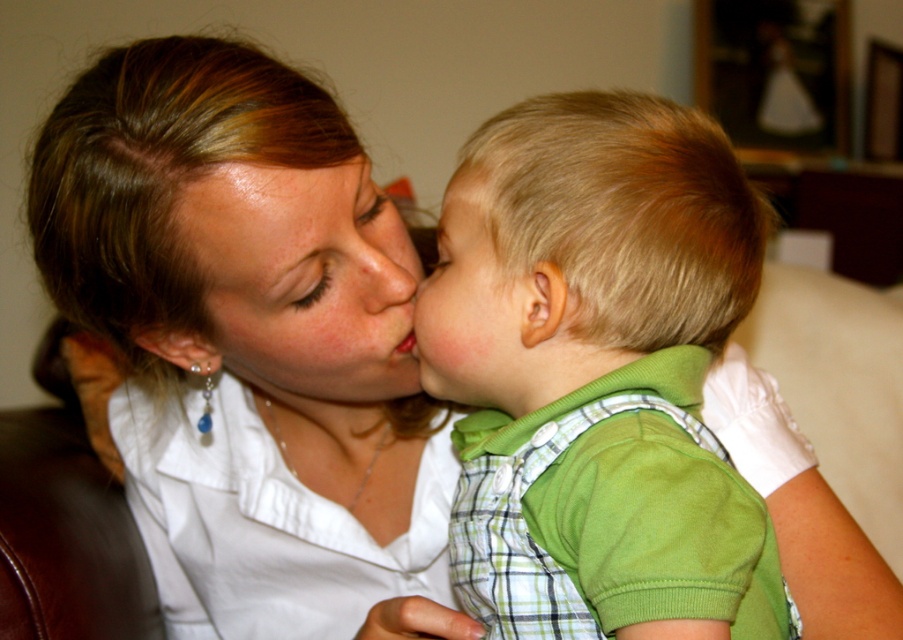
Consider the image. You are an interior designer working on a layout for a nursery. You need to place a crib and a changing table in the room. The crib is currently at the center of the room, and the changing table is on the right side. According to the image provided, where should the changing table be placed relative to the crib to ensure it is positioned similarly to the green plaid overalls at center in the scene?

The green plaid overalls at center is positioned at point (601, 371), which is slightly to the right and lower center of the image. Therefore, the changing table should be placed to the right and slightly lower than the crib to mirror this positioning.

You are a photographer observing the scene. You notice the green plaid overalls at center and the blonde hair at center. Which object is positioned to the right side of the other?

The green plaid overalls at center is to the right of blonde hair at center.

You are a photographer trying to frame a photo of the matte green shirt at center and the blonde hair at center. Which object should you adjust your camera to focus on first if you want to capture both in a single shot, considering their sizes?

The matte green shirt at center has a larger width than the blonde hair at center, so you should focus on the matte green shirt at center first to ensure it fits well within the frame before adjusting for the smaller object.